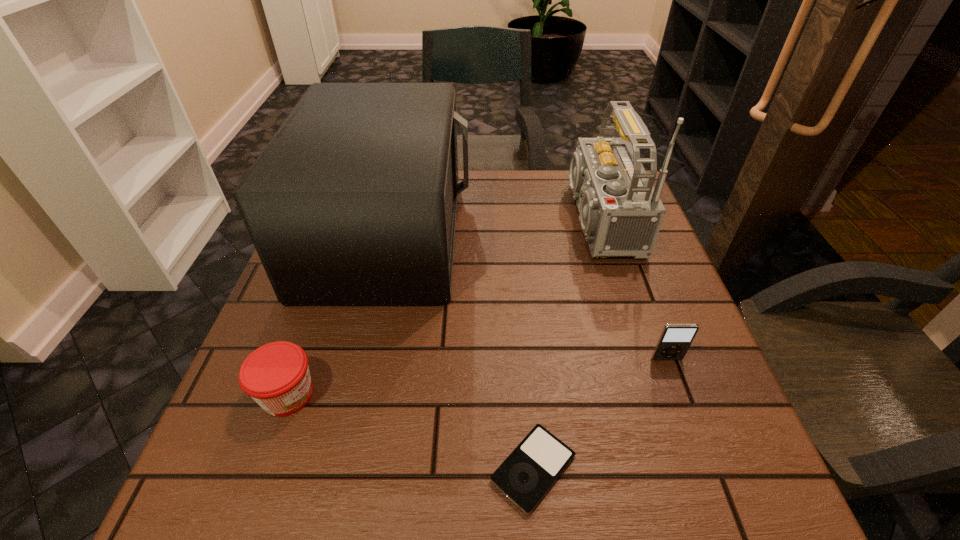
Where is `empty space between the right iPod and the second nearest object`? Image resolution: width=960 pixels, height=540 pixels. empty space between the right iPod and the second nearest object is located at coordinates (477, 377).

The image size is (960, 540). Identify the location of free area in between the nearest object and the taller iPod. (600, 414).

Where is `free space between the fourth farthest object and the fourth shortest object`? The image size is (960, 540). free space between the fourth farthest object and the fourth shortest object is located at coordinates [x=337, y=314].

Find the location of `free space between the farther iPod and the radio receiver`. free space between the farther iPod and the radio receiver is located at coordinates (630, 289).

Image resolution: width=960 pixels, height=540 pixels. In order to click on vacant area that lies between the radio receiver and the nearest object in this screenshot , I will do `click(563, 343)`.

Locate an element on the screen. The height and width of the screenshot is (540, 960). vacant area between the fourth farthest object and the farther iPod is located at coordinates (477, 377).

This screenshot has height=540, width=960. What are the coordinates of `vacant region between the radio receiver and the second nearest object` in the screenshot? It's located at (440, 307).

Locate an element on the screen. Image resolution: width=960 pixels, height=540 pixels. object that stands as the fourth closest to the fourth shortest object is located at coordinates (675, 339).

Identify the location of object that stands as the second closest to the fourth shortest object. (621, 213).

Where is `free spot that satisfies the following two spatial constraints: 1. on the front-facing side of the farther iPod; 2. on the label side of the jam`? The height and width of the screenshot is (540, 960). free spot that satisfies the following two spatial constraints: 1. on the front-facing side of the farther iPod; 2. on the label side of the jam is located at coordinates (680, 395).